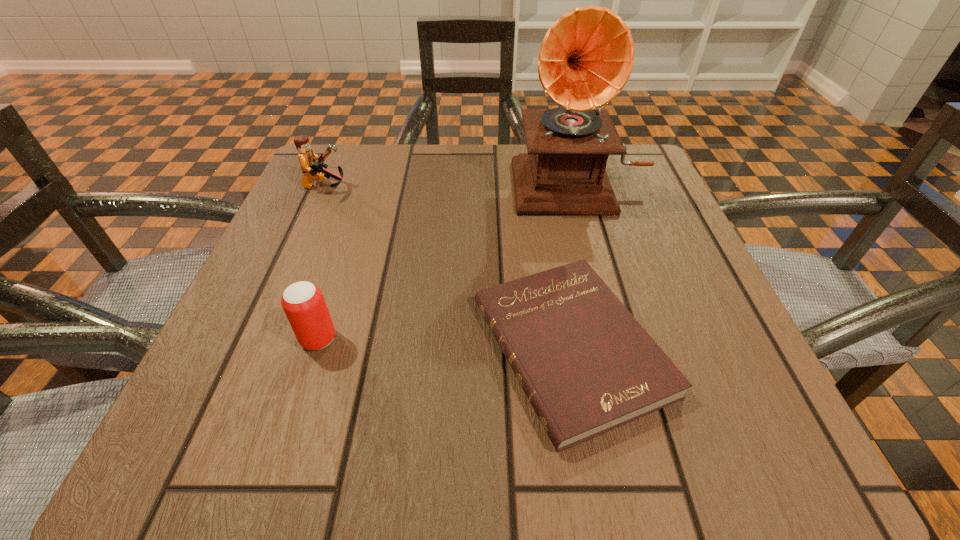
In the image, there is a desktop. Where is `vacant area at the right edge`? vacant area at the right edge is located at coordinates 627,257.

Find the location of `vacant region at the far left corner of the desktop`. vacant region at the far left corner of the desktop is located at coordinates (388, 148).

The width and height of the screenshot is (960, 540). What are the coordinates of `vacant area that lies between the leftmost object and the tallest object` in the screenshot? It's located at (452, 184).

Find the location of a particular element. The image size is (960, 540). blank region between the leftmost object and the tallest object is located at coordinates (452, 184).

Where is `free point between the phonograph record and the beer can`? free point between the phonograph record and the beer can is located at coordinates (448, 260).

At what (x,y) coordinates should I click in order to perform the action: click on vacant area that lies between the leftmost object and the hardback book. Please return your answer as a coordinate pair (x, y). The height and width of the screenshot is (540, 960). Looking at the image, I should click on (448, 267).

Image resolution: width=960 pixels, height=540 pixels. In order to click on blank region between the beer can and the hardback book in this screenshot , I will do `click(444, 343)`.

What are the coordinates of `free area in between the tallest object and the leftmost object` in the screenshot? It's located at (452, 184).

What are the coordinates of `the third closest object to the beer can` in the screenshot? It's located at (586, 58).

Image resolution: width=960 pixels, height=540 pixels. I want to click on object that ranks as the second closest to the second object from left to right, so click(x=312, y=169).